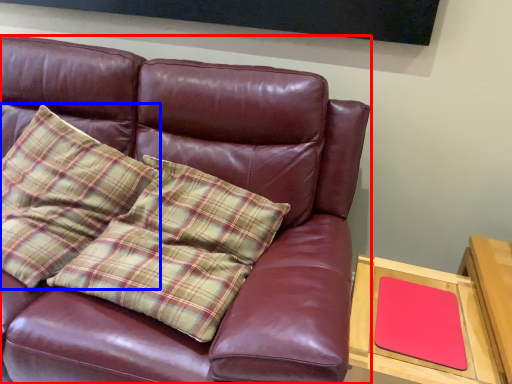
Question: Which object is further to the camera taking this photo, studio couch (highlighted by a red box) or pillow (highlighted by a blue box)?

Choices:
 (A) studio couch
 (B) pillow

Answer: (B)